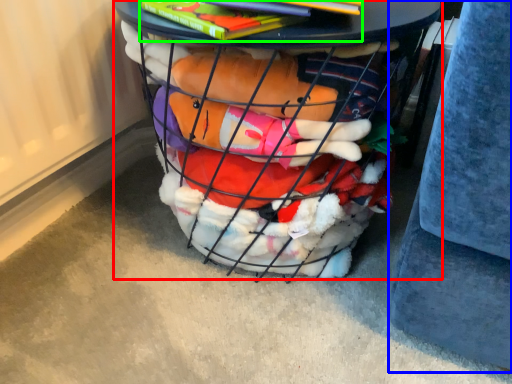
Question: Considering the real-world distances, which object is closest to furniture (highlighted by a red box)? gray (highlighted by a blue box) or book (highlighted by a green box).

Choices:
 (A) gray
 (B) book

Answer: (B)